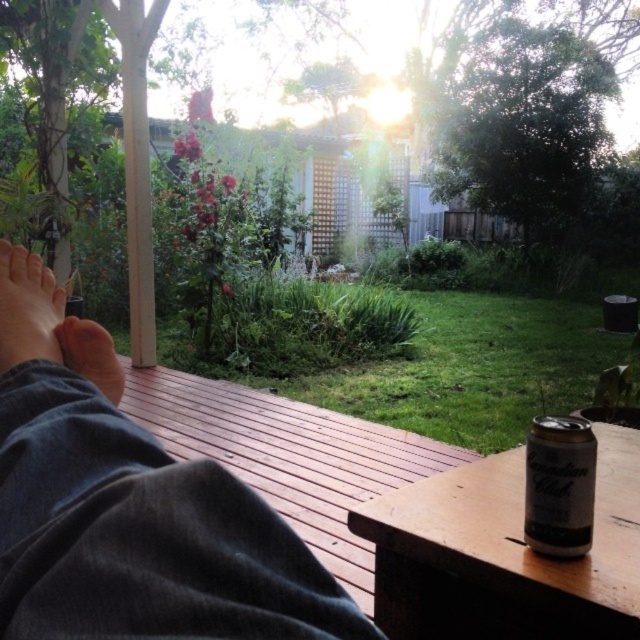
You are a photographer setting up a shot of the scene. You need to ensure that the dark gray fabric at lower left and silver metallic can at lower right are both visible in the frame. Given their heights, which object will appear larger in the photo?

The dark gray fabric at lower left has a greater height compared to the silver metallic can at lower right, so it will appear larger in the photo.

You are a photographer setting up a shot of the dark gray fabric at lower left and the silver metallic can at lower right. Do you need to adjust your camera angle to ensure both objects are fully visible in the frame?

The dark gray fabric at lower left is positioned over the silver metallic can at lower right, so the photographer does not need to adjust the camera angle because the fabric is already covering the can, ensuring both are visible in the frame.

You are a photographer setting up equipment on the wooden deck. You have a dark gray fabric at lower left and a wooden table at lower right. You need to place a large tripod between them. Can you position it so it doesn

The dark gray fabric at lower left is in front of the wooden table at lower right, so placing the tripod between them would require positioning it behind the dark gray fabric at lower left and in front of the wooden table at lower right.